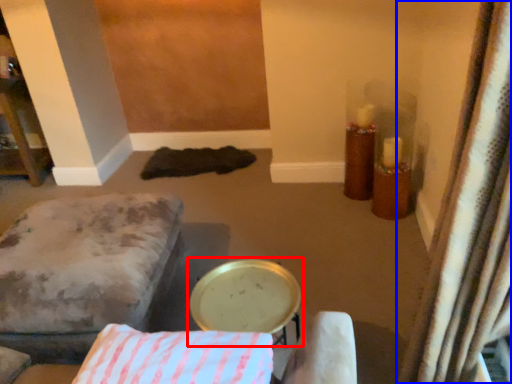
Question: Among these objects, which one is farthest to the camera, round table (highlighted by a red box) or curtain (highlighted by a blue box)?

Choices:
 (A) round table
 (B) curtain

Answer: (A)